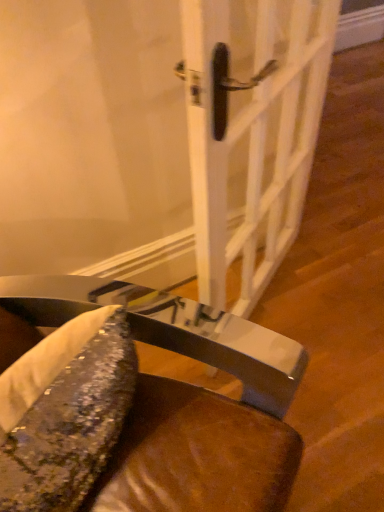
Question: Considering the relative sizes of white glossy door handle at center and shiny metallic fish at lower left in the image provided, is white glossy door handle at center smaller than shiny metallic fish at lower left?

Choices:
 (A) no
 (B) yes

Answer: (A)

Question: Is white glossy door handle at center surrounding shiny metallic fish at lower left?

Choices:
 (A) yes
 (B) no

Answer: (B)

Question: Can you confirm if white glossy door handle at center is shorter than shiny metallic fish at lower left?

Choices:
 (A) no
 (B) yes

Answer: (A)

Question: Considering the relative positions of white glossy door handle at center and shiny metallic fish at lower left in the image provided, is white glossy door handle at center behind shiny metallic fish at lower left?

Choices:
 (A) yes
 (B) no

Answer: (A)

Question: Is white glossy door handle at center positioned with its back to shiny metallic fish at lower left?

Choices:
 (A) no
 (B) yes

Answer: (A)

Question: Is white glossy door handle at center oriented towards shiny metallic fish at lower left?

Choices:
 (A) no
 (B) yes

Answer: (A)

Question: Could metallic sequined cushion at lower center be considered to be inside white glossy door handle at center?

Choices:
 (A) no
 (B) yes

Answer: (A)

Question: Does white glossy door handle at center appear on the right side of metallic sequined cushion at lower center?

Choices:
 (A) yes
 (B) no

Answer: (A)

Question: Could you tell me if white glossy door handle at center is facing metallic sequined cushion at lower center?

Choices:
 (A) yes
 (B) no

Answer: (B)

Question: From a real-world perspective, is white glossy door handle at center positioned over metallic sequined cushion at lower center based on gravity?

Choices:
 (A) no
 (B) yes

Answer: (B)

Question: From the image's perspective, would you say white glossy door handle at center is shown under metallic sequined cushion at lower center?

Choices:
 (A) yes
 (B) no

Answer: (B)

Question: Is white glossy door handle at center facing away from metallic sequined cushion at lower center?

Choices:
 (A) yes
 (B) no

Answer: (B)

Question: Does metallic sequined cushion at lower center appear on the right side of white glossy door handle at center?

Choices:
 (A) no
 (B) yes

Answer: (A)